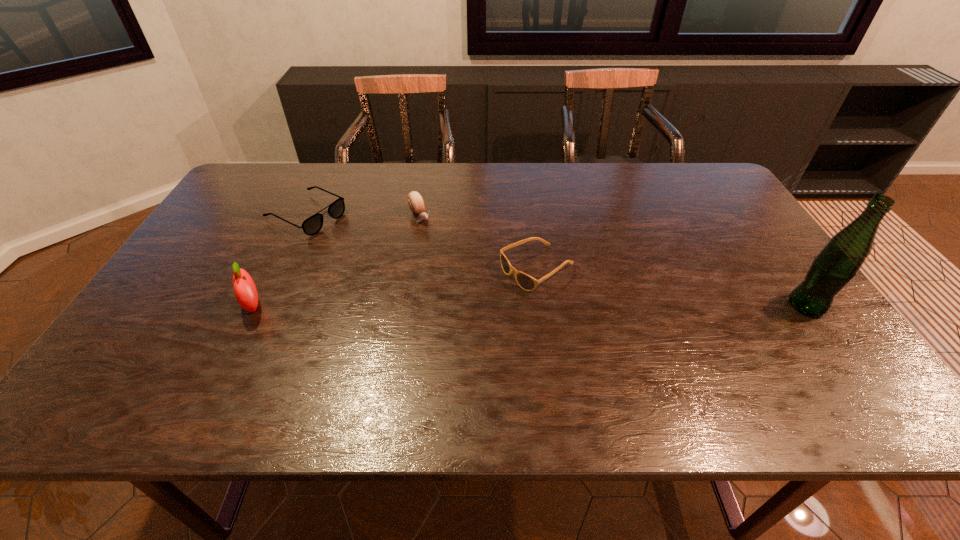
Where is `free region located 0.120m on the front-facing side of the third object from right to left`? free region located 0.120m on the front-facing side of the third object from right to left is located at coordinates (442, 251).

Locate an element on the screen. The height and width of the screenshot is (540, 960). free location located on the front-facing side of the third object from right to left is located at coordinates (474, 296).

In order to click on vacant area located 0.360m on the front-facing side of the spectacles in this screenshot , I will do `click(430, 273)`.

In order to click on free space located 0.380m on the front-facing side of the spectacles in this screenshot , I will do `click(436, 275)`.

The image size is (960, 540). In order to click on free space located on the front-facing side of the spectacles in this screenshot , I will do `click(359, 239)`.

Identify the location of vacant space situated 0.070m on the front-facing side of the sunglasses. Image resolution: width=960 pixels, height=540 pixels. click(487, 296).

Locate an element on the screen. free space located on the front-facing side of the sunglasses is located at coordinates (457, 312).

The width and height of the screenshot is (960, 540). What are the coordinates of `vacant region located on the front-facing side of the sunglasses` in the screenshot? It's located at (402, 341).

Find the location of a particular element. The width and height of the screenshot is (960, 540). object present at the far edge is located at coordinates (312, 225).

I want to click on object present at the left edge, so click(312, 225).